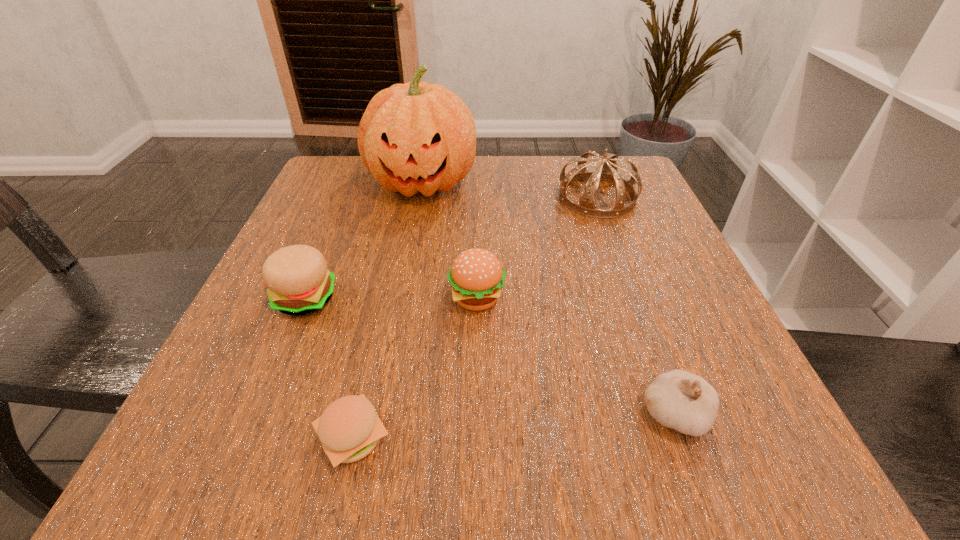
The image size is (960, 540). In order to click on vacant space located 0.050m on the left of the rightmost hamburger in this screenshot , I will do `click(418, 299)`.

Where is `vacant point located on the left of the garlic`? The height and width of the screenshot is (540, 960). vacant point located on the left of the garlic is located at coordinates (425, 414).

Locate an element on the screen. This screenshot has width=960, height=540. free spot located on the right of the second hamburger from left to right is located at coordinates (647, 438).

Image resolution: width=960 pixels, height=540 pixels. What are the coordinates of `pumpkin that is at the far edge` in the screenshot? It's located at (415, 137).

Locate an element on the screen. The height and width of the screenshot is (540, 960). tiara that is positioned at the far edge is located at coordinates (607, 171).

Locate an element on the screen. This screenshot has height=540, width=960. garlic located at the near edge is located at coordinates (677, 399).

Where is `hamburger present at the near edge`? hamburger present at the near edge is located at coordinates (349, 429).

I want to click on pumpkin located at the left edge, so click(x=415, y=137).

Where is `hamburger that is at the left edge`? Image resolution: width=960 pixels, height=540 pixels. hamburger that is at the left edge is located at coordinates (298, 282).

At what (x,y) coordinates should I click in order to perform the action: click on tiara that is at the right edge. Please return your answer as a coordinate pair (x, y). The width and height of the screenshot is (960, 540). Looking at the image, I should click on (607, 171).